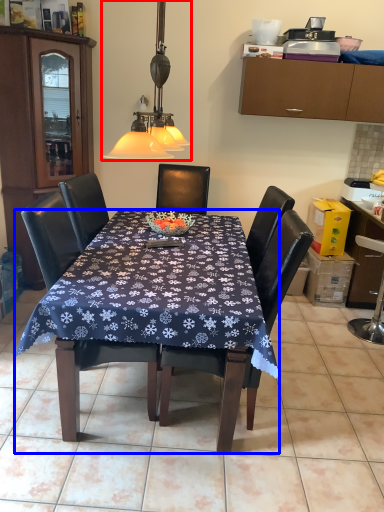
Question: Which point is further to the camera, lamp (highlighted by a red box) or desk (highlighted by a blue box)?

Choices:
 (A) lamp
 (B) desk

Answer: (B)